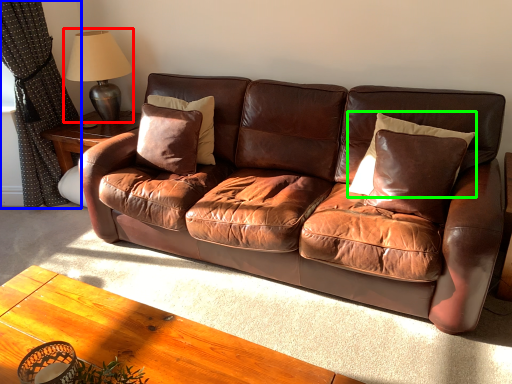
Question: Based on their relative distances, which object is nearer to table lamp (highlighted by a red box)? Choose from curtain (highlighted by a blue box) and pillow (highlighted by a green box).

Choices:
 (A) curtain
 (B) pillow

Answer: (A)